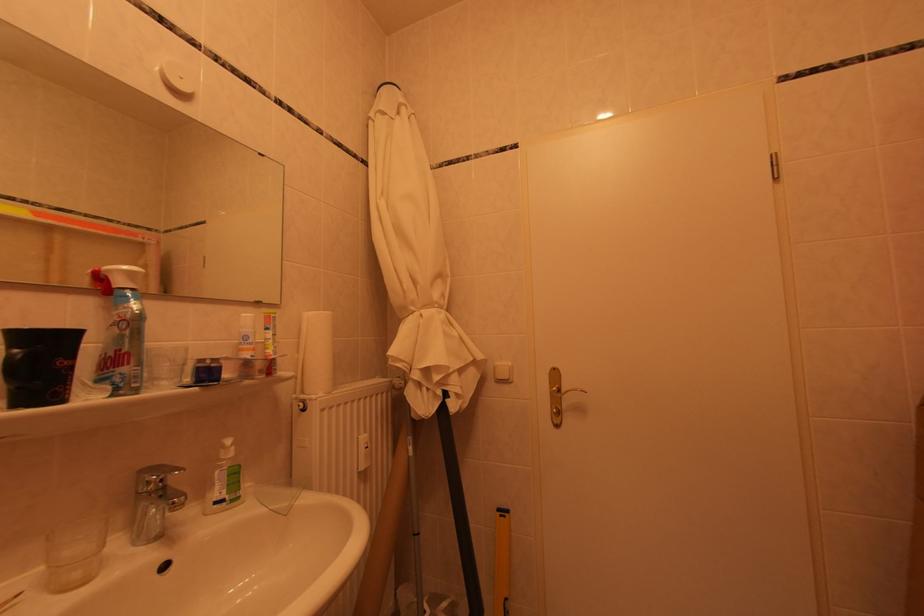
Describe the element at coordinates (153, 501) in the screenshot. I see `a chrome faucet handle` at that location.